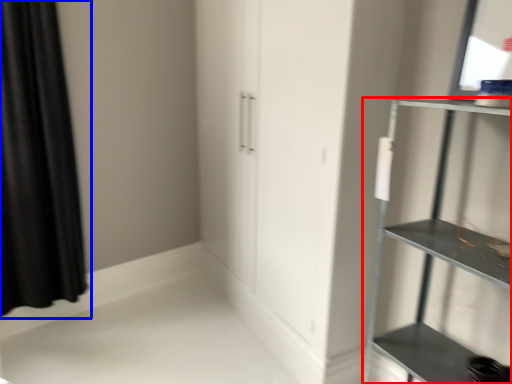
Question: Which object appears farthest to the camera in this image, shelf (highlighted by a red box) or curtain (highlighted by a blue box)?

Choices:
 (A) shelf
 (B) curtain

Answer: (B)